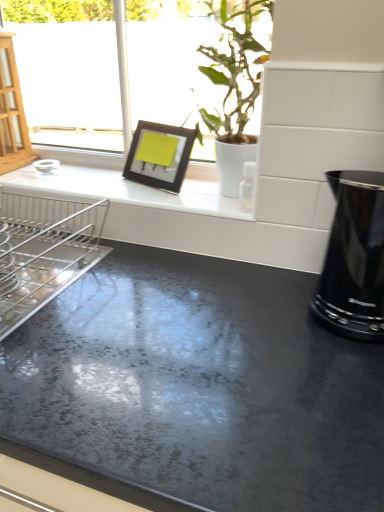
Locate an element on the screen. Image resolution: width=384 pixels, height=512 pixels. vacant space situated above white glossy countertop at upper center (from a real-world perspective) is located at coordinates (160, 190).